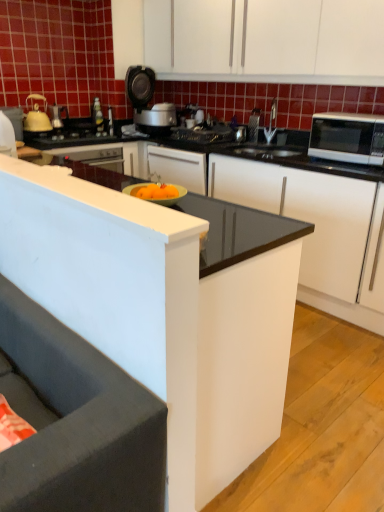
Describe the element at coordinates (37, 116) in the screenshot. I see `matte yellow tea pot at left` at that location.

This screenshot has width=384, height=512. I want to click on matte yellow tea pot at left, so click(x=37, y=116).

What do you see at coordinates (255, 124) in the screenshot? I see `metallic silver toaster at upper center` at bounding box center [255, 124].

Where is `matte yellow tea pot at left`? The height and width of the screenshot is (512, 384). matte yellow tea pot at left is located at coordinates (37, 116).

Which point is more forward, (37, 105) or (254, 135)?

Point (37, 105)

Can you see matte yellow tea pot at left touching metallic silver toaster at upper center?

No.

Can you confirm if matte yellow tea pot at left is smaller than metallic silver toaster at upper center?

No, matte yellow tea pot at left is not smaller than metallic silver toaster at upper center.

Would you say white matte cabinet at upper center, the 2th cabinetry when ordered from bottom to top, is outside white glossy microwave at right?

Absolutely, white matte cabinet at upper center, the 2th cabinetry when ordered from bottom to top, is external to white glossy microwave at right.

Which is more to the left, white matte cabinet at upper center, acting as the 1th cabinetry starting from the top, or white glossy microwave at right?

white matte cabinet at upper center, acting as the 1th cabinetry starting from the top.

Find the location of `cabinetry above the white glossy microwave at right (from a real-world perspective)`. cabinetry above the white glossy microwave at right (from a real-world perspective) is located at coordinates (265, 41).

Looking at this image, from a real-world perspective, does white matte cabinet at upper center, the 2th cabinetry when ordered from bottom to top, stand above white glossy microwave at right?

Correct, in the physical world, white matte cabinet at upper center, the 2th cabinetry when ordered from bottom to top, is higher than white glossy microwave at right.

From a real-world perspective, does white glossy cabinet at center, the 2th cabinetry in the top-to-bottom sequence, sit lower than metallic silver toaster at upper center?

Correct, in the physical world, white glossy cabinet at center, the 2th cabinetry in the top-to-bottom sequence, is lower than metallic silver toaster at upper center.

Can you confirm if white glossy cabinet at center, the 2th cabinetry in the top-to-bottom sequence, is taller than metallic silver toaster at upper center?

Yes.

Are white glossy cabinet at center, the 2th cabinetry in the top-to-bottom sequence, and metallic silver toaster at upper center located far from each other?

Yes, white glossy cabinet at center, the 2th cabinetry in the top-to-bottom sequence, and metallic silver toaster at upper center are quite far apart.

Measure the distance from black matte gas stove at center to black glossy counter at center.

3.67 feet.

Which point is more distant from viewer, (82, 134) or (341, 317)?

Positioned behind is point (82, 134).

Could black glossy counter at center be considered to be inside black matte gas stove at center?

No, black glossy counter at center is not inside black matte gas stove at center.

Is black matte gas stove at center thinner than black glossy counter at center?

Correct, the width of black matte gas stove at center is less than that of black glossy counter at center.

From a real-world perspective, is matte yellow tea pot at left positioned above or below white matte cabinet at upper center, the 2th cabinetry when ordered from bottom to top?

From a real-world perspective, matte yellow tea pot at left is physically below white matte cabinet at upper center, the 2th cabinetry when ordered from bottom to top.

Which is correct: matte yellow tea pot at left is inside white matte cabinet at upper center, acting as the 1th cabinetry starting from the top, or outside of it?

matte yellow tea pot at left is spatially situated outside white matte cabinet at upper center, acting as the 1th cabinetry starting from the top.

Does matte yellow tea pot at left turn towards white matte cabinet at upper center, acting as the 1th cabinetry starting from the top?

No, matte yellow tea pot at left is not turned towards white matte cabinet at upper center, acting as the 1th cabinetry starting from the top.

Which object is positioned more to the left, black glossy counter at center or white matte cabinet at upper center, the 2th cabinetry when ordered from bottom to top?

black glossy counter at center.

There is a black glossy counter at center. Identify the location of cabinetry above it (from a real-world perspective). (265, 41).

Is black glossy counter at center aimed at white matte cabinet at upper center, the 2th cabinetry when ordered from bottom to top?

No, black glossy counter at center is not turned towards white matte cabinet at upper center, the 2th cabinetry when ordered from bottom to top.

Which of these two, metallic silver toaster at upper center or matte yellow tea pot at left, is thinner?

With smaller width is metallic silver toaster at upper center.

Does metallic silver toaster at upper center appear on the left side of matte yellow tea pot at left?

Incorrect, metallic silver toaster at upper center is not on the left side of matte yellow tea pot at left.

Can you confirm if metallic silver toaster at upper center is shorter than matte yellow tea pot at left?

Correct, metallic silver toaster at upper center is not as tall as matte yellow tea pot at left.

Is there a large distance between metallic silver toaster at upper center and matte yellow tea pot at left?

Yes.

The width and height of the screenshot is (384, 512). I want to click on tea pot above the metallic silver toaster at upper center (from the image's perspective), so click(x=37, y=116).

Starting from the white glossy microwave at right, which cabinetry is the 1st one to the left? Please provide its 2D coordinates.

[(265, 41)]

Considering their positions, is metallic silver toaster at upper center positioned further to black glossy counter at center than dark gray fabric studio couch at lower left?

dark gray fabric studio couch at lower left lies further to black glossy counter at center than the other object.

Based on their spatial positions, is white matte cabinet at upper center, acting as the 1th cabinetry starting from the top, or black glossy counter at center closer to dark gray fabric studio couch at lower left?

Among the two, black glossy counter at center is located nearer to dark gray fabric studio couch at lower left.

Estimate the real-world distances between objects in this image. Which object is closer to white matte cabinet at upper center, the 2th cabinetry when ordered from bottom to top, matte yellow tea pot at left or black matte gas stove at center?

black matte gas stove at center.

Looking at the image, which one is located further to metallic silver toaster at upper center, dark gray fabric studio couch at lower left or black matte gas stove at center?

Among the two, dark gray fabric studio couch at lower left is located further to metallic silver toaster at upper center.

Looking at the image, which one is located further to black glossy counter at center, dark gray fabric studio couch at lower left or black matte gas stove at center?

dark gray fabric studio couch at lower left.

From the image, which object appears to be farther from black matte gas stove at center, dark gray fabric studio couch at lower left or white glossy microwave at right?

dark gray fabric studio couch at lower left is further to black matte gas stove at center.

Estimate the real-world distances between objects in this image. Which object is further from black matte gas stove at center, dark gray fabric studio couch at lower left or metallic silver toaster at upper center?

dark gray fabric studio couch at lower left is positioned further to the anchor black matte gas stove at center.

Based on their spatial positions, is white glossy microwave at right or white matte cabinet at upper center, the 2th cabinetry when ordered from bottom to top, further from metallic silver toaster at upper center?

white glossy microwave at right.

Locate an element on the screen. The width and height of the screenshot is (384, 512). counter between dark gray fabric studio couch at lower left and matte yellow tea pot at left along the z-axis is located at coordinates (299, 213).

Where is `counter between matte yellow tea pot at left and white glossy microwave at right in the horizontal direction`? counter between matte yellow tea pot at left and white glossy microwave at right in the horizontal direction is located at coordinates (299, 213).

Where is `gas stove between white glossy cabinet at center, the 2th cabinetry in the top-to-bottom sequence, and matte yellow tea pot at left from front to back`? The width and height of the screenshot is (384, 512). gas stove between white glossy cabinet at center, the 2th cabinetry in the top-to-bottom sequence, and matte yellow tea pot at left from front to back is located at coordinates pos(73,135).

The height and width of the screenshot is (512, 384). In order to click on appliance between matte yellow tea pot at left and white glossy microwave at right in this screenshot , I will do `click(255, 124)`.